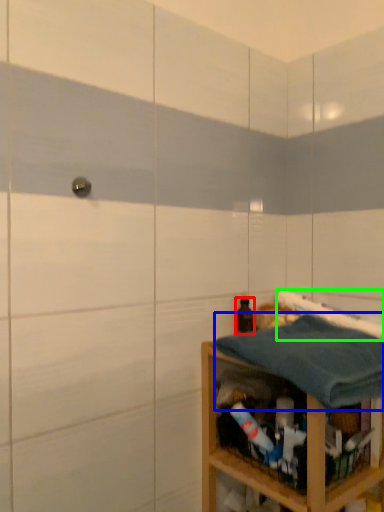
Question: Estimate the real-world distances between objects in this image. Which object is farther from bottle (highlighted by a red box), bath towel (highlighted by a blue box) or bath towel (highlighted by a green box)?

Choices:
 (A) bath towel
 (B) bath towel

Answer: (A)